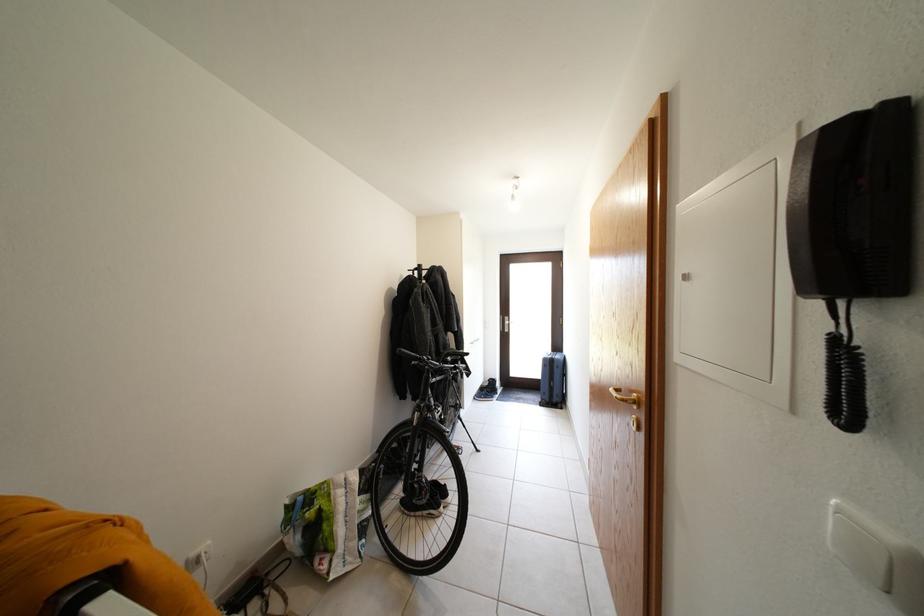
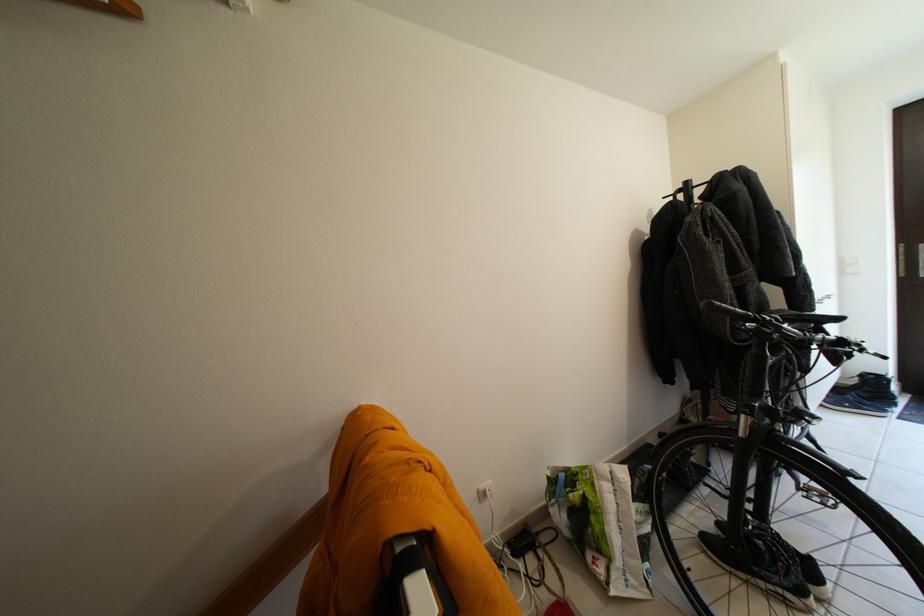
The point at (x=428, y=270) is marked in the first image. Where is the corresponding point in the second image?

(696, 188)